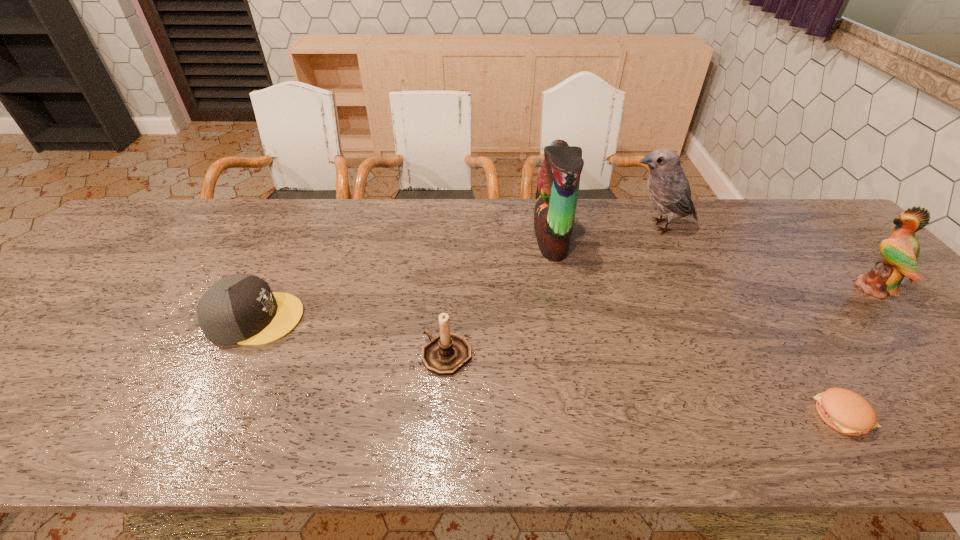
Locate an element on the screen. The width and height of the screenshot is (960, 540). vacant space situated on the front-facing side of the fifth tallest object is located at coordinates (359, 318).

Find the location of a particular element. vacant region located 0.110m on the back of the fifth object from left to right is located at coordinates click(800, 352).

The height and width of the screenshot is (540, 960). Identify the location of object situated at the near edge. (845, 411).

Locate an element on the screen. Image resolution: width=960 pixels, height=540 pixels. object positioned at the right edge is located at coordinates [x=901, y=251].

This screenshot has height=540, width=960. Identify the location of vacant space at the far edge of the desktop. (271, 219).

You are a GUI agent. You are given a task and a screenshot of the screen. Output one action in this format:
    pyautogui.click(x=<x>, y=<y>)
    Task: Click on the free location at the near edge of the desktop
    Image resolution: width=960 pixels, height=540 pixels.
    Given the screenshot: What is the action you would take?
    pyautogui.click(x=892, y=424)

Locate an element on the screen. The height and width of the screenshot is (540, 960). vacant space at the right edge of the desktop is located at coordinates (828, 278).

Where is `free space at the far right corner`? Image resolution: width=960 pixels, height=540 pixels. free space at the far right corner is located at coordinates (825, 237).

What are the coordinates of `vacant space that is in between the shortest object and the fourth tallest object` in the screenshot? It's located at (644, 386).

Locate an element on the screen. The width and height of the screenshot is (960, 540). vacant area that lies between the fourth object from left to right and the second object from right to left is located at coordinates (750, 321).